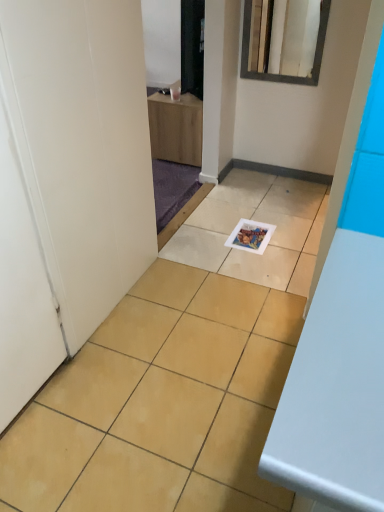
Identify the location of free space above matte paper magazine at center (from a real-world perspective). The height and width of the screenshot is (512, 384). (253, 236).